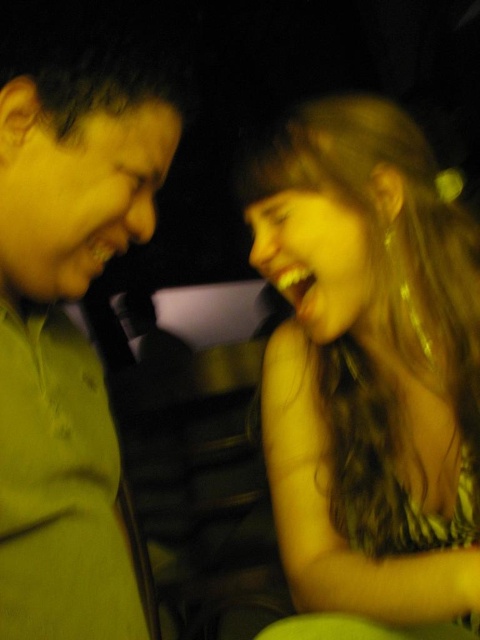
Which is in front, point (345, 115) or point (56, 376)?

Point (56, 376) is in front.

Is point (430, 264) positioned in front of point (24, 113)?

That is False.

Measure the distance between point (x=456, y=388) and camera.

They are 31.63 inches apart.

At what (x,y) coordinates should I click in order to perform the action: click on shiny gold hair at right. Please return your answer as a coordinate pair (x, y). This screenshot has height=640, width=480. Looking at the image, I should click on (370, 364).